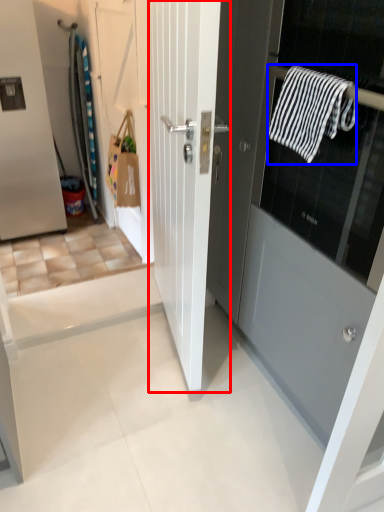
Question: Which object appears closest to the camera in this image, door (highlighted by a red box) or bath towel (highlighted by a blue box)?

Choices:
 (A) door
 (B) bath towel

Answer: (A)